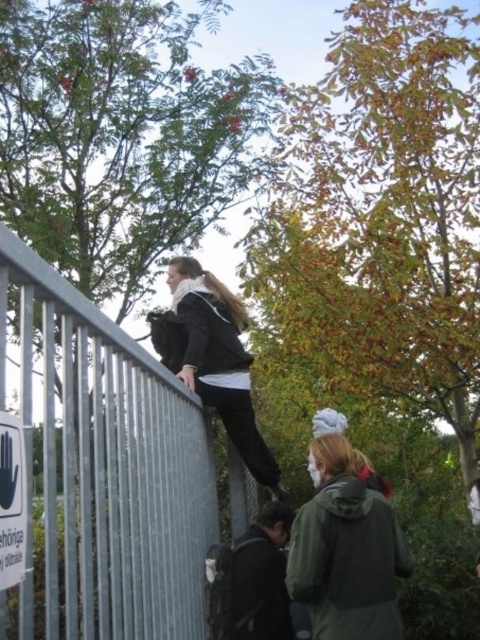
You are standing near the metallic gray fence at upper left and want to move 30 inches away from it. Is this possible?

The distance between the metallic gray fence at upper left and the viewer is currently 24.15 inches. Moving an additional 5.85 inches further away would allow you to reach 30 inches, so yes, it is possible to move 30 inches away from the metallic gray fence at upper left.

In the scene shown: You are a security guard monitoring the bridge. You see the green matte jacket at lower right and the matte black jacket at upper center. Which person is positioned farther to the east side of the bridge?

The green matte jacket at lower right is positioned farther to the east side of the bridge since it is located to the right of the matte black jacket at upper center.